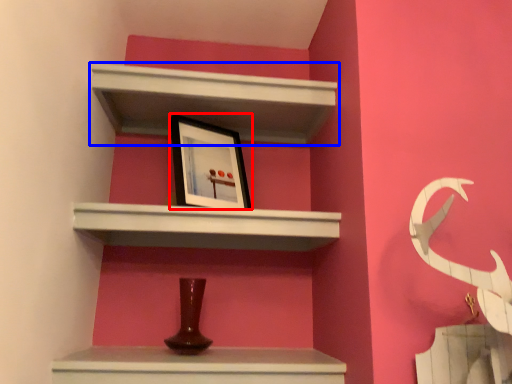
Question: Which of the following is the farthest to the observer, picture frame (highlighted by a red box) or shelf (highlighted by a blue box)?

Choices:
 (A) picture frame
 (B) shelf

Answer: (A)